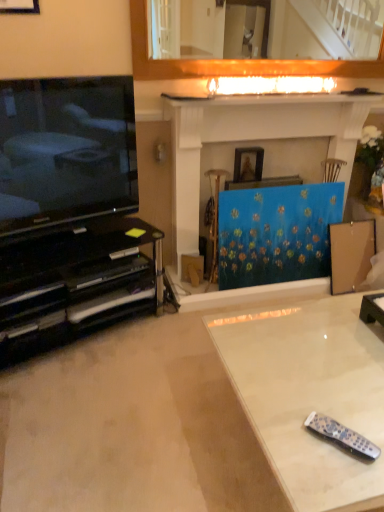
Image resolution: width=384 pixels, height=512 pixels. Find the location of `empty space that is to the right of black glass tv stand at lower left`. empty space that is to the right of black glass tv stand at lower left is located at coordinates (169, 348).